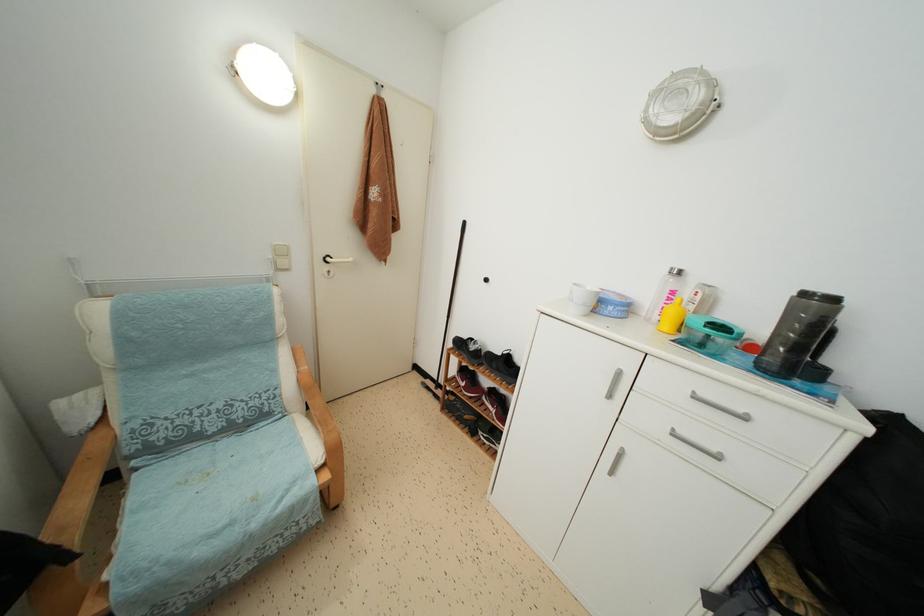
The image size is (924, 616). What do you see at coordinates (334, 262) in the screenshot?
I see `the white door handle` at bounding box center [334, 262].